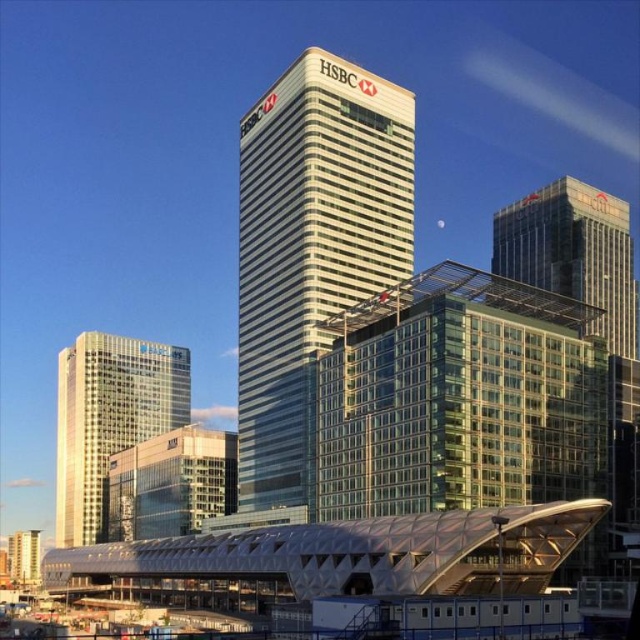
You are a drone operator tasked with flying a drone between the clear glass skyscraper at upper right and the metallic glass building at lower left. The drone has a maximum flight distance of 400 feet. Can the drone safely complete the flight between these two buildings without exceeding its range?

The clear glass skyscraper at upper right is 386.72 feet away from the metallic glass building at lower left. Since the drone has a maximum flight distance of 400 feet, it can safely complete the flight between these two buildings without exceeding its range because 386.72 feet is within the 400 feet limit.

You are a drone operator tasked with capturing aerial footage of the white glass skyscraper at center. Your drone can fly up to 100 meters away from its starting position. If you begin your flight from the base of the skyscraper, will your drone be able to maintain a safe distance while still capturing clear footage of the entire building?

The distance of white glass skyscraper at center from camera is 87.28 meters, so yes, the drone can maintain a safe distance of 87.28 meters while still capturing clear footage since it is within the drone operator limit of 100 meters.